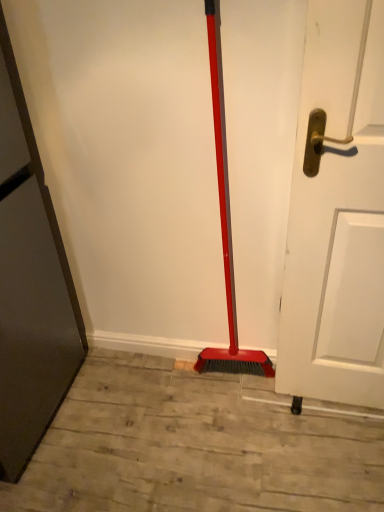
What are the coordinates of `matte black screen door at left` in the screenshot? It's located at (30, 285).

Describe the element at coordinates (30, 285) in the screenshot. I see `matte black screen door at left` at that location.

What are the coordinates of `matte black screen door at left` in the screenshot? It's located at (30, 285).